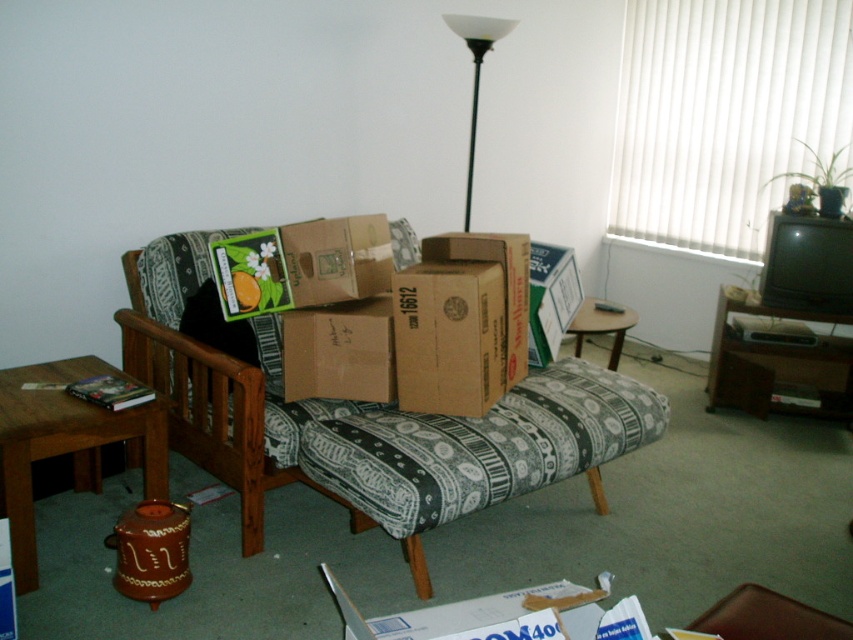
Can you confirm if brown cardboard box at center is smaller than white matte floor lamp at upper center?

Indeed, brown cardboard box at center has a smaller size compared to white matte floor lamp at upper center.

Is brown cardboard box at center positioned before white matte floor lamp at upper center?

Yes, it is.

Does point (376, 392) come in front of point (471, 125)?

Yes, it is.

At what (x,y) coordinates should I click in order to perform the action: click on brown cardboard box at center. Please return your answer as a coordinate pair (x, y). Looking at the image, I should click on (339, 352).

Based on the photo, who is more forward, (300, 419) or (344, 328)?

Positioned in front is point (300, 419).

Does patterned fabric couch at center have a smaller size compared to brown cardboard box at center?

No.

Is point (398, 460) farther from viewer compared to point (370, 342)?

No, it is in front of (370, 342).

The width and height of the screenshot is (853, 640). What are the coordinates of `patterned fabric couch at center` in the screenshot? It's located at 454,444.

Who is more distant from viewer, [164,486] or [360,321]?

The point [360,321] is behind.

Does brown wooden table at lower left have a lesser width compared to brown cardboard box at center?

Incorrect, brown wooden table at lower left's width is not less than brown cardboard box at center's.

The image size is (853, 640). Identify the location of brown wooden table at lower left. (67, 444).